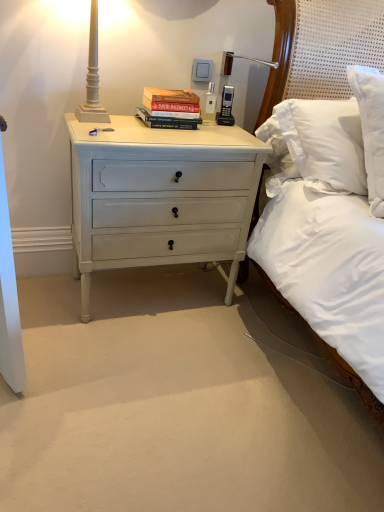
The width and height of the screenshot is (384, 512). I want to click on vacant region in front of hardcover books at center, so click(161, 131).